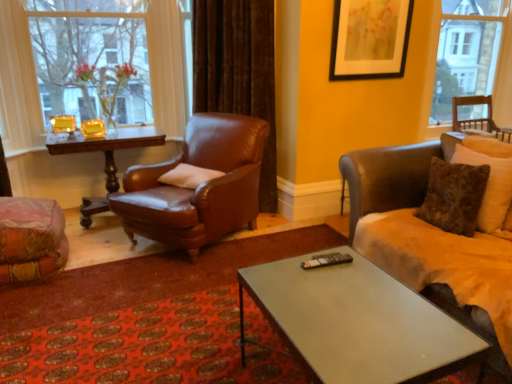
Question: Considering the relative positions of metallic gray coffee table at center and brown leather couch at right, which is counted as the third chair, starting from the left, in the image provided, is metallic gray coffee table at center to the right of brown leather couch at right, which is counted as the third chair, starting from the left, from the viewer's perspective?

Choices:
 (A) yes
 (B) no

Answer: (B)

Question: Is metallic gray coffee table at center wider than brown leather couch at right, which is counted as the third chair, starting from the left?

Choices:
 (A) yes
 (B) no

Answer: (B)

Question: Does metallic gray coffee table at center have a lesser width compared to brown leather couch at right, which is counted as the third chair, starting from the left?

Choices:
 (A) yes
 (B) no

Answer: (A)

Question: Would you say metallic gray coffee table at center is a long distance from brown leather couch at right, which is counted as the third chair, starting from the left?

Choices:
 (A) yes
 (B) no

Answer: (B)

Question: Can you confirm if metallic gray coffee table at center is taller than brown leather couch at right, the 2th chair viewed from the right?

Choices:
 (A) yes
 (B) no

Answer: (B)

Question: From a real-world perspective, does metallic gray coffee table at center stand above brown leather couch at right, which is counted as the third chair, starting from the left?

Choices:
 (A) no
 (B) yes

Answer: (A)

Question: From the image's perspective, is matte black picture frame at upper center on brown leather couch at right, which is counted as the third chair, starting from the left?

Choices:
 (A) yes
 (B) no

Answer: (A)

Question: Considering the relative sizes of matte black picture frame at upper center and brown leather couch at right, which is counted as the third chair, starting from the left, in the image provided, is matte black picture frame at upper center taller than brown leather couch at right, which is counted as the third chair, starting from the left,?

Choices:
 (A) yes
 (B) no

Answer: (B)

Question: Is matte black picture frame at upper center oriented away from brown leather couch at right, the 2th chair viewed from the right?

Choices:
 (A) no
 (B) yes

Answer: (A)

Question: Is matte black picture frame at upper center shorter than brown leather couch at right, which is counted as the third chair, starting from the left?

Choices:
 (A) yes
 (B) no

Answer: (A)

Question: Would you consider matte black picture frame at upper center to be distant from brown leather couch at right, which is counted as the third chair, starting from the left?

Choices:
 (A) no
 (B) yes

Answer: (B)

Question: Does matte black picture frame at upper center appear on the left side of brown leather couch at right, the 2th chair viewed from the right?

Choices:
 (A) yes
 (B) no

Answer: (A)

Question: From the image's perspective, is white soft pillow at center under matte black picture frame at upper center?

Choices:
 (A) yes
 (B) no

Answer: (A)